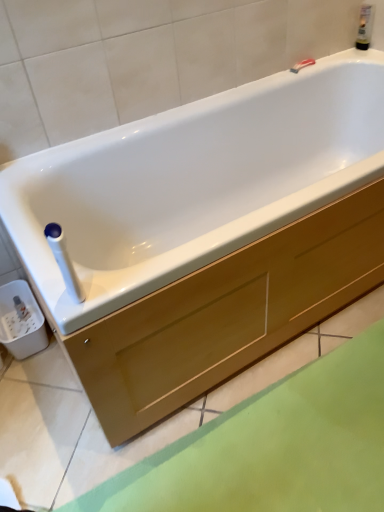
Question: Is white plastic towel bar at upper left wider than translucent plastic bottle at upper right?

Choices:
 (A) no
 (B) yes

Answer: (B)

Question: Does white plastic towel bar at upper left come in front of translucent plastic bottle at upper right?

Choices:
 (A) no
 (B) yes

Answer: (B)

Question: Does white plastic towel bar at upper left touch translucent plastic bottle at upper right?

Choices:
 (A) yes
 (B) no

Answer: (B)

Question: From a real-world perspective, is white plastic towel bar at upper left below translucent plastic bottle at upper right?

Choices:
 (A) yes
 (B) no

Answer: (A)

Question: Considering the relative positions of white plastic towel bar at upper left and translucent plastic bottle at upper right in the image provided, is white plastic towel bar at upper left behind translucent plastic bottle at upper right?

Choices:
 (A) yes
 (B) no

Answer: (B)

Question: Does white plastic towel bar at upper left have a lesser width compared to translucent plastic bottle at upper right?

Choices:
 (A) no
 (B) yes

Answer: (A)

Question: Is there a large distance between translucent plastic bottle at upper right and matte wood drawer at center?

Choices:
 (A) no
 (B) yes

Answer: (B)

Question: Considering the relative sizes of translucent plastic bottle at upper right and matte wood drawer at center in the image provided, is translucent plastic bottle at upper right smaller than matte wood drawer at center?

Choices:
 (A) no
 (B) yes

Answer: (B)

Question: From a real-world perspective, does translucent plastic bottle at upper right stand above matte wood drawer at center?

Choices:
 (A) no
 (B) yes

Answer: (B)

Question: Is the depth of translucent plastic bottle at upper right less than that of matte wood drawer at center?

Choices:
 (A) yes
 (B) no

Answer: (B)

Question: From a real-world perspective, is translucent plastic bottle at upper right located beneath matte wood drawer at center?

Choices:
 (A) no
 (B) yes

Answer: (A)

Question: Is matte wood drawer at center a part of translucent plastic bottle at upper right?

Choices:
 (A) yes
 (B) no

Answer: (B)

Question: Is white plastic towel bar at upper left closer to the viewer compared to matte wood drawer at center?

Choices:
 (A) no
 (B) yes

Answer: (A)